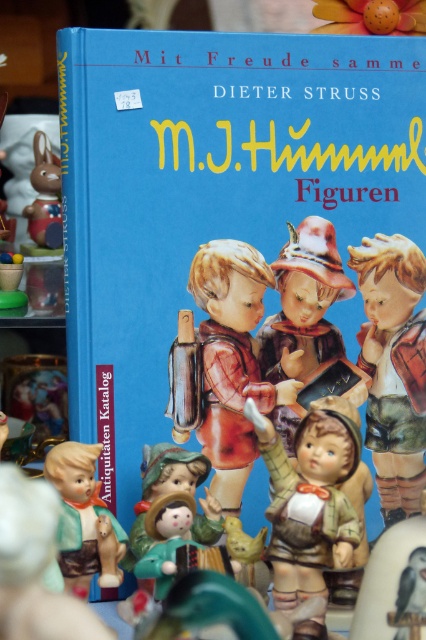
Is point (218, 321) positioned after point (353, 285)?

No, (218, 321) is in front of (353, 285).

Does matte porcelain child at center have a larger size compared to matte porcelain doll at center?

Indeed, matte porcelain child at center has a larger size compared to matte porcelain doll at center.

Between point (201, 300) and point (307, 298), which one is positioned behind?

The point (307, 298) is more distant.

Image resolution: width=426 pixels, height=640 pixels. Identify the location of matte porcelain child at center. (232, 360).

Measure the distance between matte porcelain child at center and camera.

matte porcelain child at center is 28.66 inches from camera.

Locate an element on the screen. matte porcelain child at center is located at coordinates (232, 360).

You are a GUI agent. You are given a task and a screenshot of the screen. Output one action in this format:
    pyautogui.click(x=<x>, y=<y>)
    Task: Click on the matte porcelain child at center
    
    Given the screenshot: What is the action you would take?
    pyautogui.click(x=232, y=360)

Is matte porcelain child at center taller than white matte bird at center?

Yes, matte porcelain child at center is taller than white matte bird at center.

Is matte porcelain child at center thinner than white matte bird at center?

In fact, matte porcelain child at center might be wider than white matte bird at center.

This screenshot has height=640, width=426. What do you see at coordinates (232, 360) in the screenshot?
I see `matte porcelain child at center` at bounding box center [232, 360].

This screenshot has height=640, width=426. What are the coordinates of `matte porcelain child at center` in the screenshot? It's located at (232, 360).